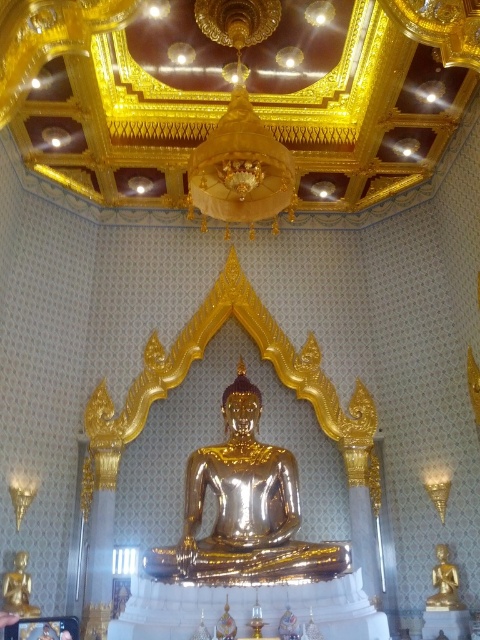
You are an architect designing a new temple and want to ensure there is enough space between the gold shiny statue at center and the gold polished statue at lower left for visitors to walk comfortably. According to temple guidelines, the minimum required distance between such statues should be 5 meters. Can the current spacing accommodate this requirement?

The gold shiny statue at center is 5.63 meters from the gold polished statue at lower left, which exceeds the minimum required distance of 5 meters. Therefore, the current spacing can accommodate the requirement.

You are standing in the temple and want to take a photo of the gold shiny statue at center. If your camera can only focus on objects within a 0.5 meter radius around the point 0.798, 0.510, will the statue be in focus?

The gold shiny statue at center is located exactly at the point (244, 509), so it will be in focus since the camera focuses on that exact point within the 0.5 meter radius.

You are standing in the temple and want to take a closer look at both the gold polished statue at lower left and the gold shiny statue at lower right. Which statue should you approach first to see the one that is nearer to you?

The gold polished statue at lower left is closer to the viewer, so you should approach it first to see the one that is nearer to you.